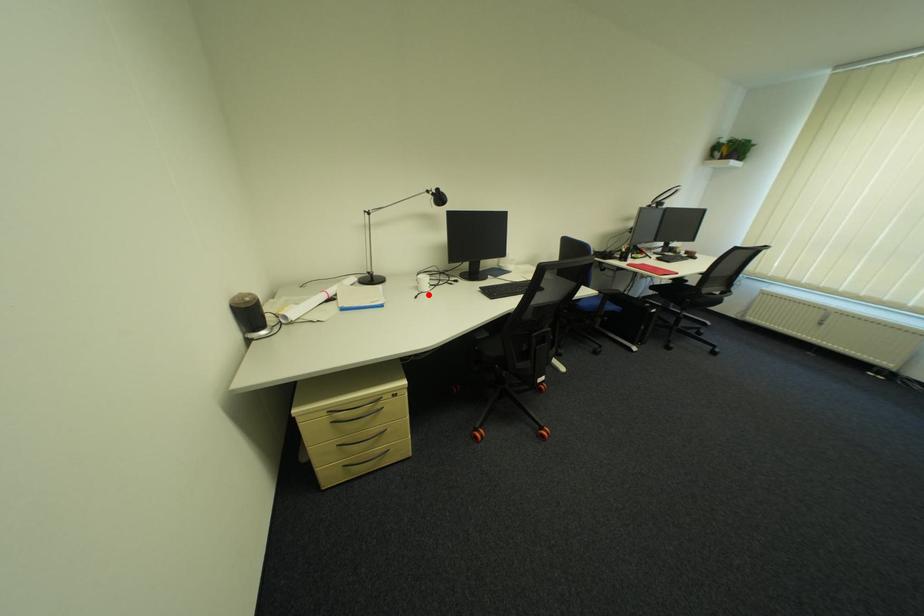
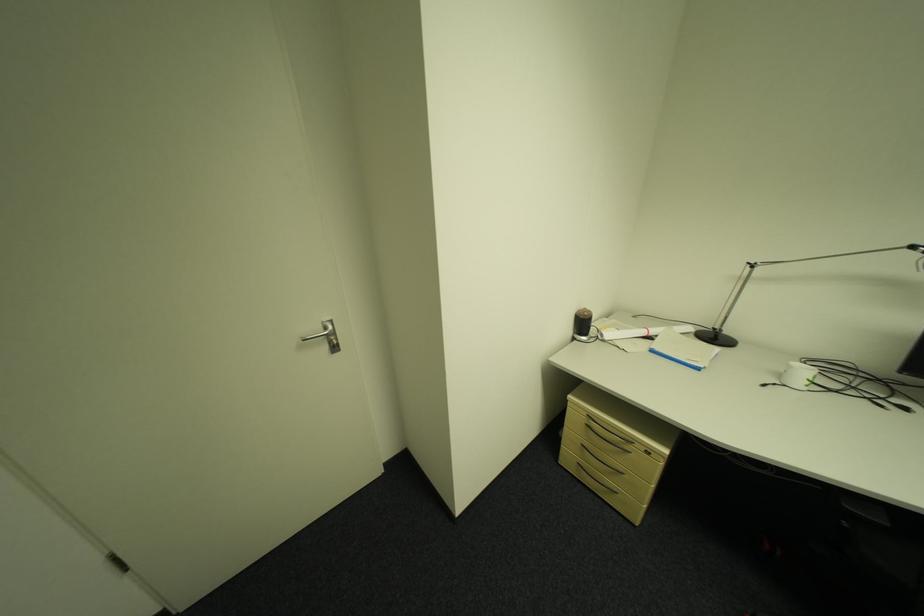
Question: I am providing you with two images of the same scene from different viewpoints. A red point is marked on the first image. At the location where the point appears in image 1, is it still visible in image 2?

Choices:
 (A) Yes
 (B) No

Answer: (A)